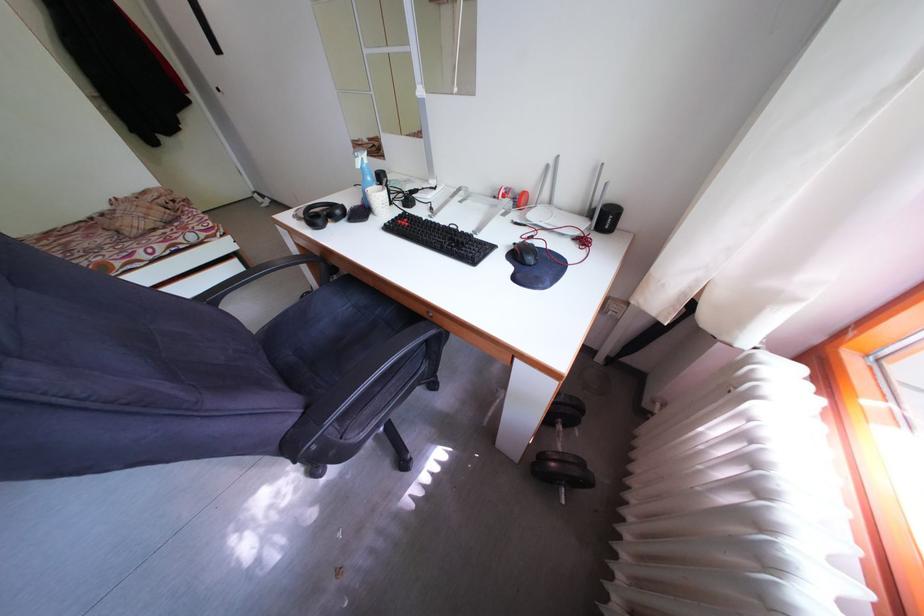
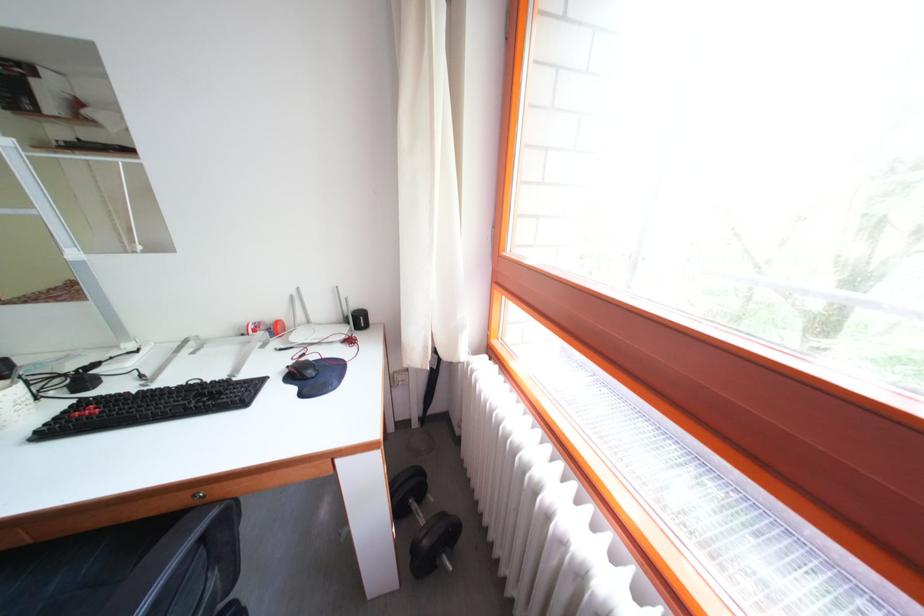
The point at [622,204] is marked in the first image. Where is the corresponding point in the second image?

(365, 312)